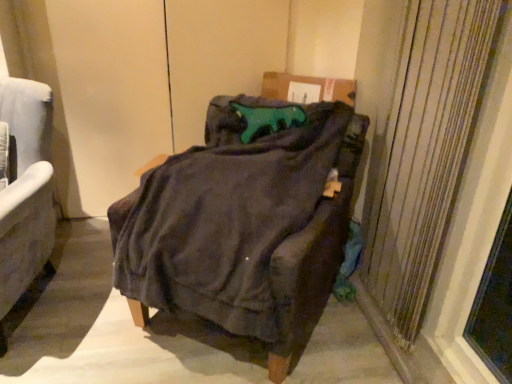
Question: Is dark fabric chair at center, which is counted as the 1th chair, starting from the right, at the back of textured beige curtain at right?

Choices:
 (A) no
 (B) yes

Answer: (B)

Question: Can you confirm if textured beige curtain at right is thinner than dark fabric chair at center, which is counted as the 1th chair, starting from the right?

Choices:
 (A) no
 (B) yes

Answer: (B)

Question: Is textured beige curtain at right positioned in front of dark fabric chair at center, which ranks as the 2th chair in left-to-right order?

Choices:
 (A) yes
 (B) no

Answer: (B)

Question: From a real-world perspective, is textured beige curtain at right under dark fabric chair at center, which is counted as the 1th chair, starting from the right?

Choices:
 (A) yes
 (B) no

Answer: (B)

Question: Is textured beige curtain at right facing towards dark fabric chair at center, which ranks as the 2th chair in left-to-right order?

Choices:
 (A) yes
 (B) no

Answer: (A)

Question: From the image's perspective, is textured beige curtain at right positioned above or below dark fabric chair at center, which is counted as the 1th chair, starting from the right?

Choices:
 (A) below
 (B) above

Answer: (B)

Question: Considering the positions of textured beige curtain at right and dark fabric chair at center, which is counted as the 1th chair, starting from the right, in the image, is textured beige curtain at right taller or shorter than dark fabric chair at center, which is counted as the 1th chair, starting from the right,?

Choices:
 (A) tall
 (B) short

Answer: (A)

Question: Is textured beige curtain at right wider or thinner than dark fabric chair at center, which is counted as the 1th chair, starting from the right?

Choices:
 (A) wide
 (B) thin

Answer: (B)

Question: From a real-world perspective, is textured beige curtain at right above or below dark fabric chair at center, which is counted as the 1th chair, starting from the right?

Choices:
 (A) above
 (B) below

Answer: (A)

Question: Is dark fabric chair at center, which is counted as the 1th chair, starting from the right, taller or shorter than velvet gray armchair at left, the first chair viewed from the left?

Choices:
 (A) tall
 (B) short

Answer: (B)

Question: Based on their sizes in the image, would you say dark fabric chair at center, which ranks as the 2th chair in left-to-right order, is bigger or smaller than velvet gray armchair at left, the first chair viewed from the left?

Choices:
 (A) big
 (B) small

Answer: (A)

Question: Is point (237, 218) closer or farther from the camera than point (45, 241)?

Choices:
 (A) closer
 (B) farther

Answer: (A)

Question: Which is correct: dark fabric chair at center, which ranks as the 2th chair in left-to-right order, is inside velvet gray armchair at left, the first chair viewed from the left, or outside of it?

Choices:
 (A) outside
 (B) inside

Answer: (A)

Question: Does point pyautogui.click(x=5, y=246) appear closer or farther from the camera than point pyautogui.click(x=417, y=294)?

Choices:
 (A) farther
 (B) closer

Answer: (B)

Question: Is velvet gray armchair at left, the second chair positioned from the right, to the left or to the right of textured beige curtain at right in the image?

Choices:
 (A) right
 (B) left

Answer: (B)